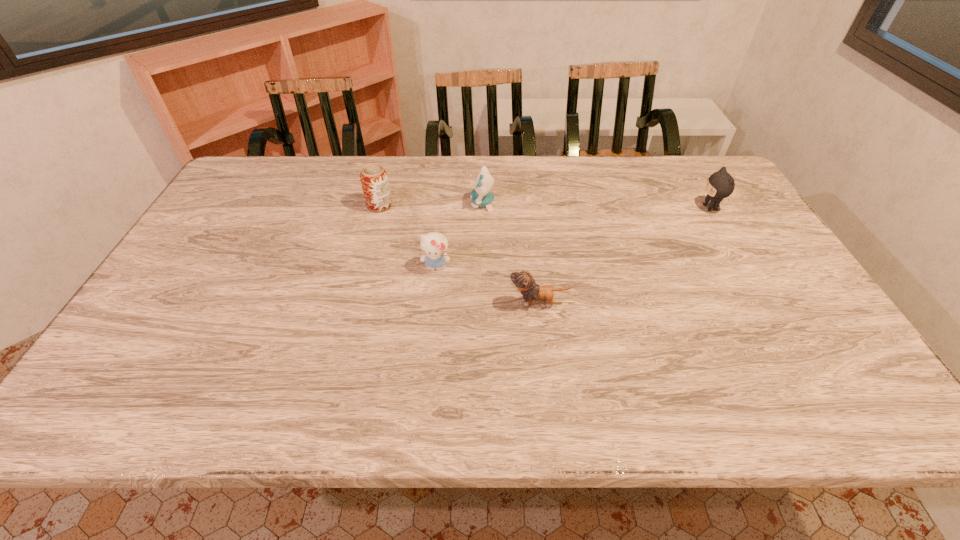
The height and width of the screenshot is (540, 960). Find the location of `blank space at the far edge`. blank space at the far edge is located at coordinates (572, 192).

Where is `free location at the near edge`? free location at the near edge is located at coordinates (245, 418).

I want to click on free space at the left edge of the desktop, so click(171, 366).

Where is `vacant space at the right edge of the desktop`? Image resolution: width=960 pixels, height=540 pixels. vacant space at the right edge of the desktop is located at coordinates click(x=783, y=270).

Locate an element on the screen. The image size is (960, 540). vacant space at the near right corner of the desktop is located at coordinates (822, 410).

This screenshot has width=960, height=540. I want to click on free space between the nearest kitten and the third kitten from right to left, so click(x=511, y=253).

You are a GUI agent. You are given a task and a screenshot of the screen. Output one action in this format:
    pyautogui.click(x=<x>, y=<y>)
    Task: Click on the vacant region between the third farthest kitten and the third kitten from left to right
    The height and width of the screenshot is (540, 960).
    Given the screenshot: What is the action you would take?
    coord(488,285)

Identify the location of free space between the leftmost object and the third kitten from left to right. The width and height of the screenshot is (960, 540). (459, 254).

Identify the location of free space between the second nearest object and the rightmost object. The height and width of the screenshot is (540, 960). (573, 237).

What are the coordinates of `free space between the third object from right to left and the rightmost object` in the screenshot? It's located at (596, 206).